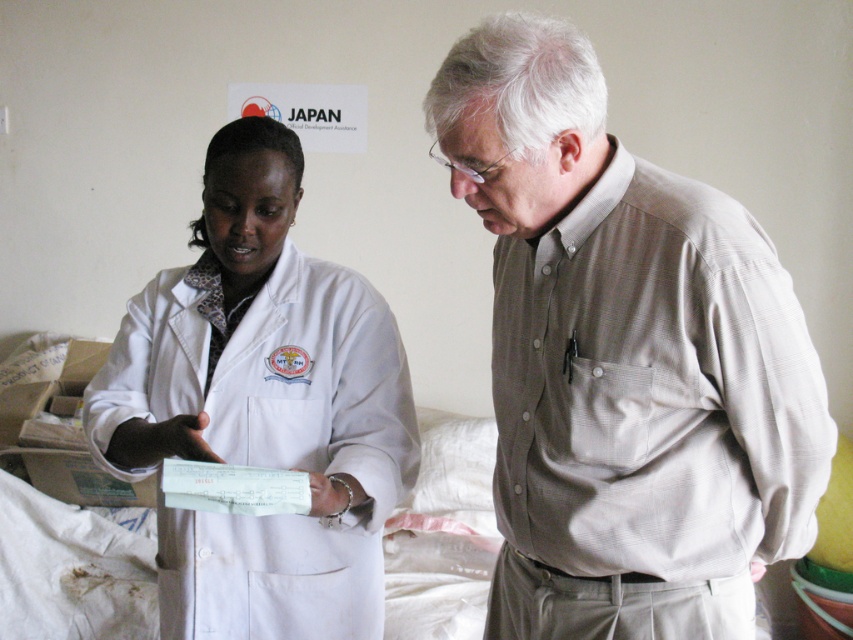
You are a patient in a clinic and see two lab coats at center. The one on top is white smooth lab coat at center and the bottom one is white matte lab coat at center. Which lab coat is visible more on top?

The white smooth lab coat at center is positioned over white matte lab coat at center, so the white smooth lab coat at center is more visible on top.

You are standing in a healthcare setting and see the white smooth lab coat at center. If you want to reach it without moving your feet, can you do it?

The white smooth lab coat at center is 3.31 feet away from the viewer, so if you can reach 3.31 feet without moving your feet, you can reach it. Otherwise, you might need to adjust your position.